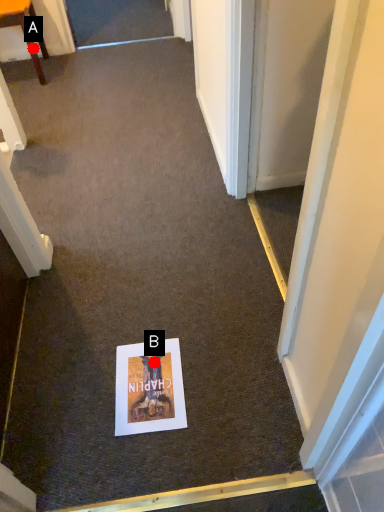
Question: Two points are circled on the image, labeled by A and B beside each circle. Which point appears farthest from the camera in this image?

Choices:
 (A) A is further
 (B) B is further

Answer: (A)